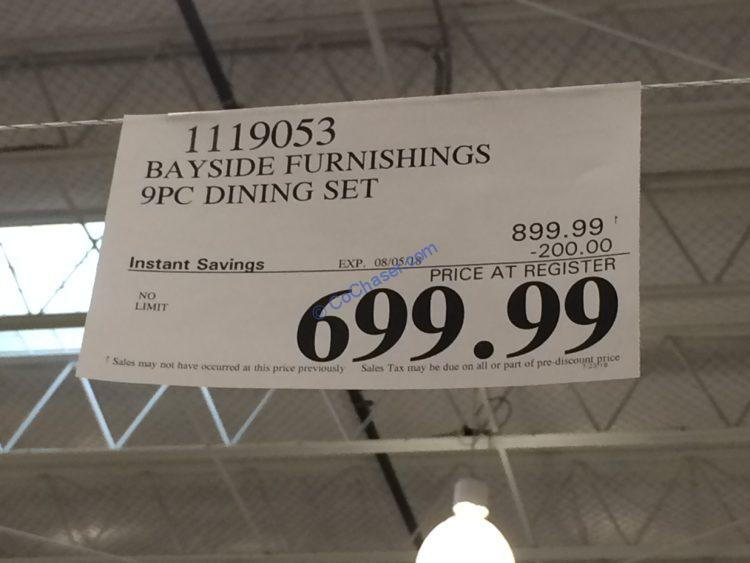
The image size is (750, 563). I want to click on light, so click(x=475, y=542).